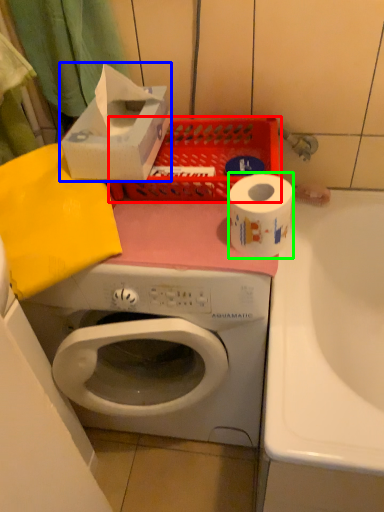
Question: Which object is positioned closest to basket (highlighted by a red box)? Select from storage box (highlighted by a blue box) and toilet paper (highlighted by a green box).

Choices:
 (A) storage box
 (B) toilet paper

Answer: (A)